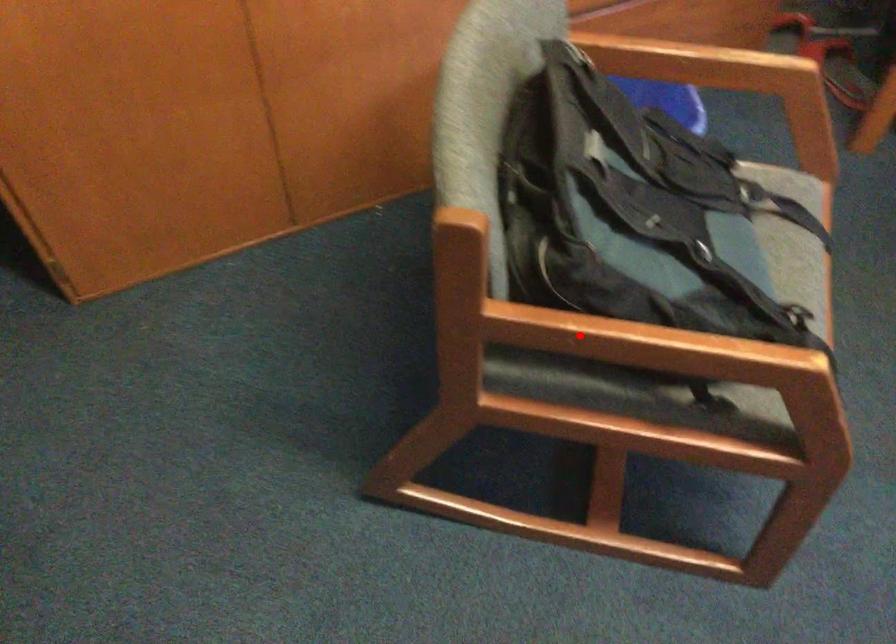
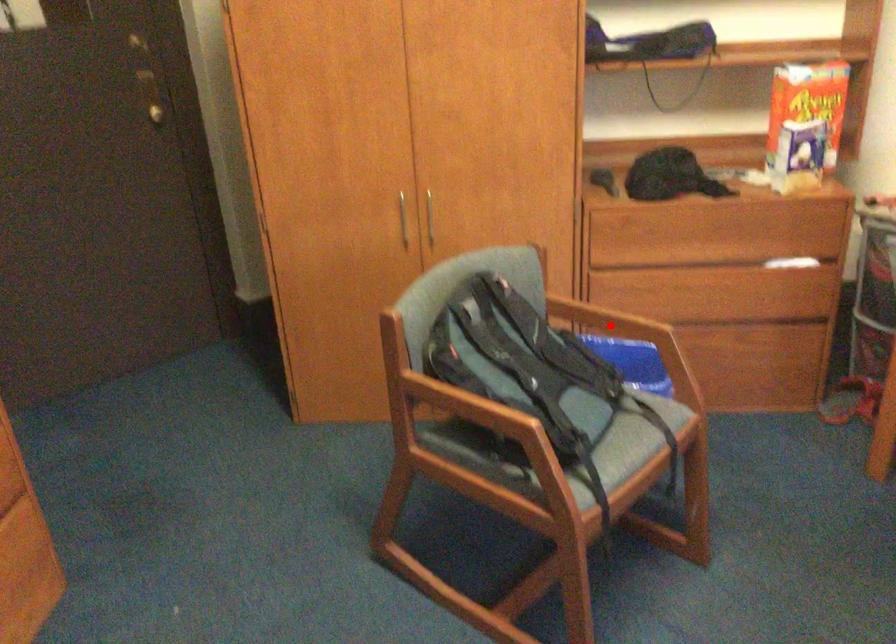
I am providing you with two images of the same scene from different viewpoints. A red point is marked on the first image and another point is marked on the second image. Are the points marked in image1 and image2 representing the same 3D position?

No